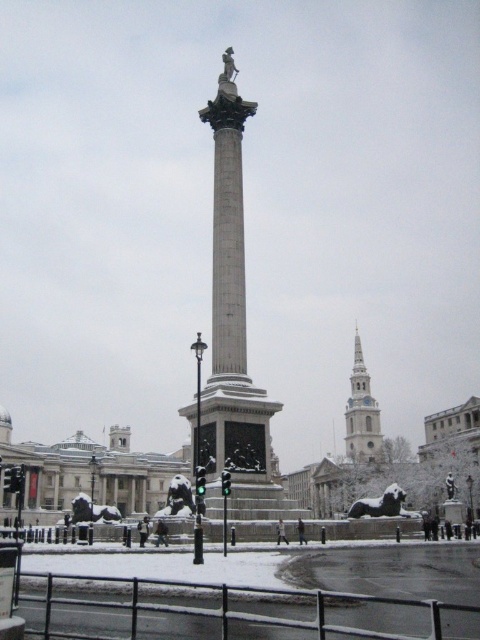
Is white stone spire at upper right positioned before bronze lion at lower right?

No, it is not.

Which of these two, white stone spire at upper right or bronze lion at lower right, stands taller?

With more height is white stone spire at upper right.

Does point (351, 440) come behind point (385, 509)?

Yes, point (351, 440) is behind point (385, 509).

In order to click on white stone spire at upper right in this screenshot , I will do click(361, 412).

Who is more distant from viewer, (243, 468) or (356, 390)?

Positioned behind is point (356, 390).

Who is positioned more to the right, smooth stone column at center or white stone spire at upper right?

white stone spire at upper right is more to the right.

At what (x,y) coordinates should I click in order to perform the action: click on smooth stone column at center. Please return your answer as a coordinate pair (x, y). This screenshot has height=640, width=480. Looking at the image, I should click on (232, 333).

The height and width of the screenshot is (640, 480). In order to click on smooth stone column at center in this screenshot , I will do `click(232, 333)`.

Between smooth stone column at center and bronze lion at lower right, which one has less height?

bronze lion at lower right is shorter.

Who is positioned more to the left, smooth stone column at center or bronze lion at lower right?

smooth stone column at center is more to the left.

Does point (222, 420) come farther from viewer compared to point (348, 509)?

No, it is in front of (348, 509).

Identify the location of smooth stone column at center. This screenshot has width=480, height=640. (232, 333).